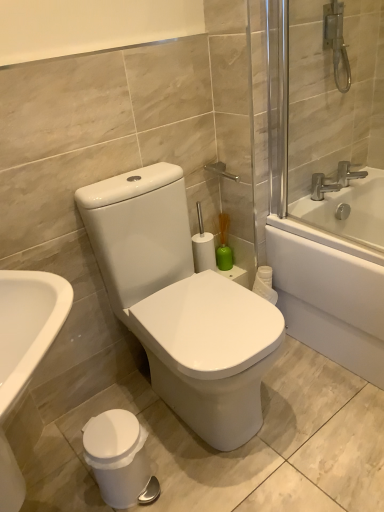
Find the location of a particular element. Image resolution: width=384 pixels, height=512 pixels. white plastic trash can at lower left is located at coordinates (117, 456).

The image size is (384, 512). What do you see at coordinates (181, 304) in the screenshot?
I see `white glossy toilet at center` at bounding box center [181, 304].

How much space does silver metallic faucet at upper right, which is the 2th tap from left to right, occupy vertically?

The height of silver metallic faucet at upper right, which is the 2th tap from left to right, is 11.01 centimeters.

Locate an element on the screen. The height and width of the screenshot is (512, 384). white plastic trash can at lower left is located at coordinates (117, 456).

Can you see white glossy toilet at center touching white glossy bathtub at upper right?

There is a gap between white glossy toilet at center and white glossy bathtub at upper right.

Does white glossy toilet at center lie behind white glossy bathtub at upper right?

No, white glossy toilet at center is closer to the camera.

From a real-world perspective, who is located higher, white glossy toilet at center or white glossy bathtub at upper right?

white glossy toilet at center.

Based on the photo, is white glossy toilet at center taller or shorter than white glossy bathtub at upper right?

white glossy toilet at center is taller than white glossy bathtub at upper right.

Which of these two, silver metallic faucet at upper right, the first tap from the left, or white plastic trash can at lower left, is bigger?

white plastic trash can at lower left.

Do you think silver metallic faucet at upper right, marked as the 2th tap in a right-to-left arrangement, is within white plastic trash can at lower left, or outside of it?

silver metallic faucet at upper right, marked as the 2th tap in a right-to-left arrangement, exists outside the volume of white plastic trash can at lower left.

Is silver metallic faucet at upper right, the first tap from the left, further to camera compared to white plastic trash can at lower left?

Yes, it is behind white plastic trash can at lower left.

From a real-world perspective, is silver metallic faucet at upper right, marked as the 2th tap in a right-to-left arrangement, on white plastic trash can at lower left?

Indeed, from a real-world perspective, silver metallic faucet at upper right, marked as the 2th tap in a right-to-left arrangement, stands above white plastic trash can at lower left.

Considering the relative sizes of white plastic trash can at lower left and white glossy bathtub at upper right in the image provided, is white plastic trash can at lower left wider than white glossy bathtub at upper right?

Incorrect, the width of white plastic trash can at lower left does not surpass that of white glossy bathtub at upper right.

Which object is positioned more to the right, white plastic trash can at lower left or white glossy bathtub at upper right?

Positioned to the right is white glossy bathtub at upper right.

Would you say white plastic trash can at lower left is outside white glossy bathtub at upper right?

Yes, white plastic trash can at lower left is located beyond the bounds of white glossy bathtub at upper right.

Is silver metallic faucet at upper right, the first tap from the left, placed right next to white glossy bathtub at upper right?

No, silver metallic faucet at upper right, the first tap from the left, is not in contact with white glossy bathtub at upper right.

Which is in front, point (318, 193) or point (356, 308)?

The point (356, 308) is more forward.

From a real-world perspective, which object rests below the other?

From a 3D spatial view, white glossy bathtub at upper right is below.

Can you confirm if silver metallic faucet at upper right, marked as the 2th tap in a right-to-left arrangement, is bigger than white glossy bathtub at upper right?

No, silver metallic faucet at upper right, marked as the 2th tap in a right-to-left arrangement, is not bigger than white glossy bathtub at upper right.

From a real-world perspective, is silver metallic faucet at upper right, the first tap from the left, positioned over white glossy toilet at center based on gravity?

Correct, in the physical world, silver metallic faucet at upper right, the first tap from the left, is higher than white glossy toilet at center.

Considering the sizes of objects silver metallic faucet at upper right, marked as the 2th tap in a right-to-left arrangement, and white glossy toilet at center in the image provided, who is smaller, silver metallic faucet at upper right, marked as the 2th tap in a right-to-left arrangement, or white glossy toilet at center?

Smaller between the two is silver metallic faucet at upper right, marked as the 2th tap in a right-to-left arrangement.

Could you tell me if silver metallic faucet at upper right, the first tap from the left, is facing white glossy toilet at center?

No, silver metallic faucet at upper right, the first tap from the left, is not aimed at white glossy toilet at center.

Can you tell me how much silver metallic faucet at upper right, marked as the 2th tap in a right-to-left arrangement, and white glossy toilet at center differ in facing direction?

0.248 degrees separate the facing orientations of silver metallic faucet at upper right, marked as the 2th tap in a right-to-left arrangement, and white glossy toilet at center.

From a real-world perspective, is silver metallic faucet at upper right, which is the 2th tap from left to right, below white plastic trash can at lower left?

Incorrect, from a real-world perspective, silver metallic faucet at upper right, which is the 2th tap from left to right, is higher than white plastic trash can at lower left.

From the image's perspective, which one is positioned lower, silver metallic faucet at upper right, the first tap from the right, or white plastic trash can at lower left?

From the image's view, white plastic trash can at lower left is below.

Locate an element on the screen. the 2nd tap located above the white plastic trash can at lower left (from a real-world perspective) is located at coordinates (348, 173).

Is silver metallic faucet at upper right, which is the 2th tap from left to right, positioned beyond the bounds of white plastic trash can at lower left?

Absolutely, silver metallic faucet at upper right, which is the 2th tap from left to right, is external to white plastic trash can at lower left.

How different are the orientations of white glossy toilet at center and silver metallic faucet at upper right, marked as the 2th tap in a right-to-left arrangement, in degrees?

0.248 degrees.

Is white glossy toilet at center turned away from silver metallic faucet at upper right, marked as the 2th tap in a right-to-left arrangement?

That's not correct — white glossy toilet at center is not looking away from silver metallic faucet at upper right, marked as the 2th tap in a right-to-left arrangement.

Between white glossy toilet at center and silver metallic faucet at upper right, the first tap from the left, which one has less height?

silver metallic faucet at upper right, the first tap from the left.

At what (x,y) coordinates should I click in order to perform the action: click on toilet that is in front of the white glossy bathtub at upper right. Please return your answer as a coordinate pair (x, y). This screenshot has width=384, height=512. Looking at the image, I should click on pos(181,304).

This screenshot has height=512, width=384. What are the coordinates of `tap that is the 1st one when counting rightward from the white plastic trash can at lower left` in the screenshot? It's located at (322, 187).

Considering their positions, is silver metallic faucet at upper right, the first tap from the right, positioned closer to silver metallic faucet at upper right, marked as the 2th tap in a right-to-left arrangement, than white glossy bathtub at upper right?

The object closer to silver metallic faucet at upper right, marked as the 2th tap in a right-to-left arrangement, is silver metallic faucet at upper right, the first tap from the right.

Based on their spatial positions, is white glossy bathtub at upper right or white plastic trash can at lower left further from white glossy toilet at center?

white glossy bathtub at upper right lies further to white glossy toilet at center than the other object.

From the image, which object appears to be nearer to white glossy bathtub at upper right, silver metallic faucet at upper right, the first tap from the right, or white glossy toilet at center?

silver metallic faucet at upper right, the first tap from the right.

From the image, which object appears to be nearer to silver metallic faucet at upper right, the first tap from the right, white plastic trash can at lower left or white glossy toilet at center?

white glossy toilet at center is closer to silver metallic faucet at upper right, the first tap from the right.

Considering their positions, is white glossy toilet at center positioned further to white glossy bathtub at upper right than silver metallic faucet at upper right, marked as the 2th tap in a right-to-left arrangement?

The object further to white glossy bathtub at upper right is white glossy toilet at center.

When comparing their distances from white glossy toilet at center, does silver metallic faucet at upper right, the first tap from the right, or white plastic trash can at lower left seem closer?

white plastic trash can at lower left.

Estimate the real-world distances between objects in this image. Which object is further from white glossy toilet at center, white glossy bathtub at upper right or silver metallic faucet at upper right, the first tap from the left?

silver metallic faucet at upper right, the first tap from the left, is further to white glossy toilet at center.

When comparing their distances from silver metallic faucet at upper right, the first tap from the right, does silver metallic faucet at upper right, the first tap from the left, or white plastic trash can at lower left seem further?

white plastic trash can at lower left is further to silver metallic faucet at upper right, the first tap from the right.

You are a GUI agent. You are given a task and a screenshot of the screen. Output one action in this format:
    pyautogui.click(x=<x>, y=<y>)
    Task: Click on the bathtub between white glossy toilet at center and silver metallic faucet at upper right, which is the 2th tap from left to right, along the z-axis
    
    Given the screenshot: What is the action you would take?
    pyautogui.click(x=334, y=275)

Where is `tap between silver metallic faucet at upper right, which is the 2th tap from left to right, and white plastic trash can at lower left vertically`? The width and height of the screenshot is (384, 512). tap between silver metallic faucet at upper right, which is the 2th tap from left to right, and white plastic trash can at lower left vertically is located at coordinates (322, 187).

You are a GUI agent. You are given a task and a screenshot of the screen. Output one action in this format:
    pyautogui.click(x=<x>, y=<y>)
    Task: Click on the tap between white glossy toilet at center and silver metallic faucet at upper right, which is the 2th tap from left to right, from front to back
    This screenshot has width=384, height=512.
    Given the screenshot: What is the action you would take?
    pyautogui.click(x=322, y=187)

At what (x,y) coordinates should I click in order to perform the action: click on tap between white glossy bathtub at upper right and silver metallic faucet at upper right, the first tap from the right, from front to back. Please return your answer as a coordinate pair (x, y). Looking at the image, I should click on (322, 187).